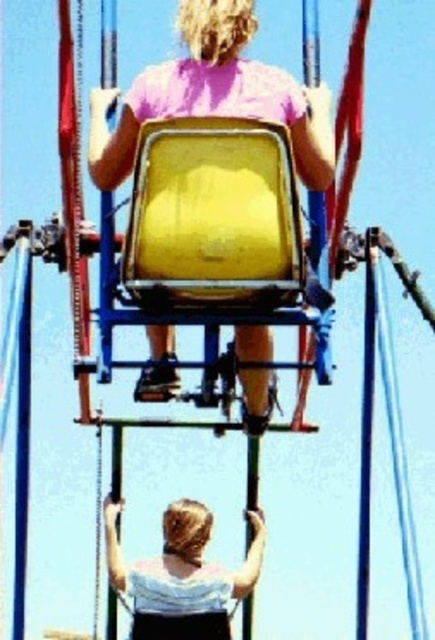
Does yellow matte seat at center have a lesser height compared to white matte shirt at lower center?

Incorrect, yellow matte seat at center's height does not fall short of white matte shirt at lower center's.

Between yellow matte seat at center and white matte shirt at lower center, which one is positioned lower?

Positioned lower is white matte shirt at lower center.

Does point (311, 93) come farther from viewer compared to point (194, 506)?

That is False.

Where is `yellow matte seat at center`? yellow matte seat at center is located at coordinates (214, 96).